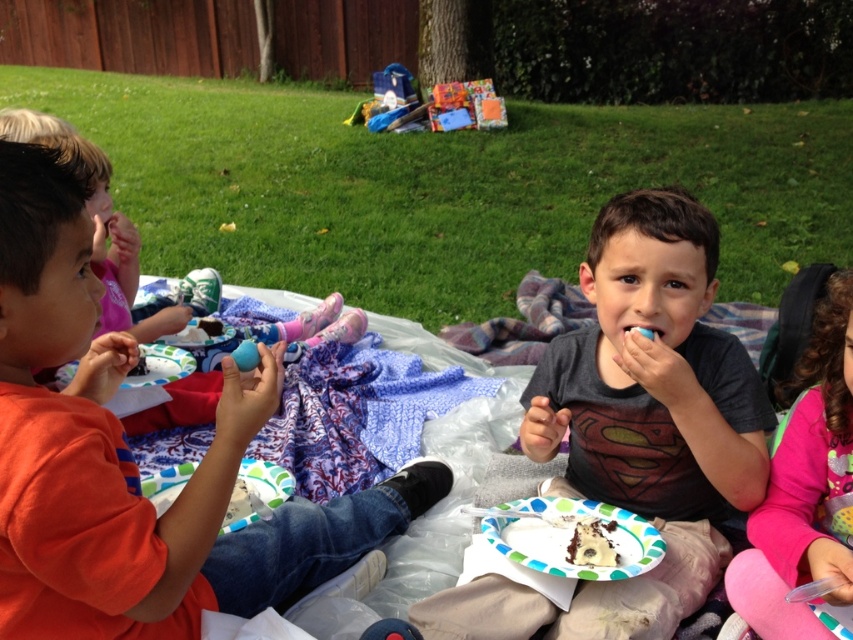
Consider the image. You are a photographer trying to capture a group photo of the orange cotton shirt at left and the pink fleece sweater at lower right. Since you want to ensure both are in focus, you need to know which one is taller. Can you tell me which is taller?

The orange cotton shirt at left has a greater height compared to the pink fleece sweater at lower right, so the orange cotton shirt at left is taller.